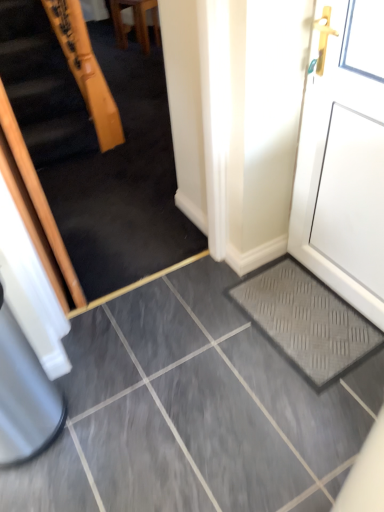
What is the approximate height of wooden chair at upper center?

The height of wooden chair at upper center is 19.81 inches.

This screenshot has height=512, width=384. What do you see at coordinates (307, 321) in the screenshot? I see `grey rubber doormat at lower right` at bounding box center [307, 321].

Describe the element at coordinates (93, 156) in the screenshot. The image size is (384, 512). I see `wooden handrail at upper left` at that location.

Identify the location of wooden chair at upper center. (135, 22).

Does white matte door at right have a smaller size compared to wooden chair at upper center?

Yes.

From the image's perspective, which is above, white matte door at right or wooden chair at upper center?

wooden chair at upper center.

Is white matte door at right oriented away from wooden chair at upper center?

No.

The image size is (384, 512). What are the coordinates of `door above the wooden chair at upper center (from a real-world perspective)` in the screenshot? It's located at (344, 157).

Who is more distant, grey rubber doormat at lower right or wooden chair at upper center?

wooden chair at upper center is behind.

Can you tell me how much grey rubber doormat at lower right and wooden chair at upper center differ in facing direction?

They differ by 17.9 degrees in their facing directions.

Which object is wider, grey rubber doormat at lower right or wooden chair at upper center?

grey rubber doormat at lower right is wider.

From the image's perspective, between grey rubber doormat at lower right and wooden chair at upper center, which one is located above?

wooden chair at upper center is shown above in the image.

Is wooden chair at upper center shorter than wooden handrail at upper left?

Yes.

From the image's perspective, is wooden chair at upper center beneath wooden handrail at upper left?

No, from the image's perspective, wooden chair at upper center is not beneath wooden handrail at upper left.

Looking at this image, can you confirm if wooden chair at upper center is bigger than wooden handrail at upper left?

No, wooden chair at upper center is not bigger than wooden handrail at upper left.

Is wooden chair at upper center not inside wooden handrail at upper left?

wooden chair at upper center lies outside wooden handrail at upper left's area.

Is wooden chair at upper center at the right side of white matte door at right?

No.

Is wooden chair at upper center positioned with its back to white matte door at right?

wooden chair at upper center is not turned away from white matte door at right.

Looking at this image, from the image's perspective, is wooden chair at upper center above white matte door at right?

Indeed, from the image's perspective, wooden chair at upper center is shown above white matte door at right.

Considering the positions of objects wooden handrail at upper left and white matte door at right in the image provided, who is more to the left, wooden handrail at upper left or white matte door at right?

Positioned to the left is wooden handrail at upper left.

Considering the positions of points (117, 90) and (318, 211), is point (117, 90) closer to camera compared to point (318, 211)?

No.

Does wooden handrail at upper left have a greater height compared to white matte door at right?

Indeed, wooden handrail at upper left has a greater height compared to white matte door at right.

Does wooden handrail at upper left touch white matte door at right?

wooden handrail at upper left and white matte door at right are clearly separated.

Considering the relative sizes of grey rubber doormat at lower right and wooden handrail at upper left in the image provided, is grey rubber doormat at lower right shorter than wooden handrail at upper left?

Indeed, grey rubber doormat at lower right has a lesser height compared to wooden handrail at upper left.

Are grey rubber doormat at lower right and wooden handrail at upper left far apart?

That's right, there is a large distance between grey rubber doormat at lower right and wooden handrail at upper left.

Between grey rubber doormat at lower right and wooden handrail at upper left, which one has smaller size?

Smaller between the two is grey rubber doormat at lower right.

Does grey rubber doormat at lower right come behind wooden handrail at upper left?

Yes, grey rubber doormat at lower right is further from the camera.

Is point (143, 37) less distant than point (261, 275)?

No.

From the image's perspective, which one is positioned lower, wooden chair at upper center or grey rubber doormat at lower right?

grey rubber doormat at lower right.

Looking at this image, considering the sizes of objects wooden chair at upper center and grey rubber doormat at lower right in the image provided, who is smaller, wooden chair at upper center or grey rubber doormat at lower right?

Smaller between the two is grey rubber doormat at lower right.

Does wooden chair at upper center contain grey rubber doormat at lower right?

Definitely not — grey rubber doormat at lower right is not inside wooden chair at upper center.

Find the location of a particular element. The height and width of the screenshot is (512, 384). furniture above the white matte door at right (from the image's perspective) is located at coordinates (135, 22).

Locate an element on the screen. The height and width of the screenshot is (512, 384). furniture behind the grey rubber doormat at lower right is located at coordinates (135, 22).

Considering their positions, is wooden chair at upper center positioned further to wooden handrail at upper left than white matte door at right?

Based on the image, wooden chair at upper center appears to be further to wooden handrail at upper left.

From the image, which object appears to be farther from white matte door at right, grey rubber doormat at lower right or wooden handrail at upper left?

wooden handrail at upper left is further to white matte door at right.

Considering their positions, is wooden handrail at upper left positioned closer to white matte door at right than grey rubber doormat at lower right?

The object closer to white matte door at right is grey rubber doormat at lower right.

Considering their positions, is grey rubber doormat at lower right positioned closer to white matte door at right than wooden chair at upper center?

Among the two, grey rubber doormat at lower right is located nearer to white matte door at right.

Looking at the image, which one is located further to wooden handrail at upper left, white matte door at right or grey rubber doormat at lower right?

Based on the image, white matte door at right appears to be further to wooden handrail at upper left.

Considering their positions, is wooden chair at upper center positioned further to white matte door at right than grey rubber doormat at lower right?

Based on the image, wooden chair at upper center appears to be further to white matte door at right.

Which object lies further to the anchor point wooden chair at upper center, white matte door at right or grey rubber doormat at lower right?

Based on the image, grey rubber doormat at lower right appears to be further to wooden chair at upper center.

Which object lies nearer to the anchor point wooden chair at upper center, wooden handrail at upper left or white matte door at right?

wooden handrail at upper left lies closer to wooden chair at upper center than the other object.

The width and height of the screenshot is (384, 512). I want to click on escalator between white matte door at right and wooden chair at upper center from front to back, so click(x=93, y=156).

At what (x,y) coordinates should I click in order to perform the action: click on doormat situated between wooden handrail at upper left and white matte door at right from left to right. Please return your answer as a coordinate pair (x, y). Looking at the image, I should click on click(307, 321).

At what (x,y) coordinates should I click in order to perform the action: click on doormat located between wooden handrail at upper left and wooden chair at upper center in the depth direction. Please return your answer as a coordinate pair (x, y). The width and height of the screenshot is (384, 512). Looking at the image, I should click on (307, 321).

At what (x,y) coordinates should I click in order to perform the action: click on doormat located between white matte door at right and wooden chair at upper center in the depth direction. Please return your answer as a coordinate pair (x, y). Image resolution: width=384 pixels, height=512 pixels. Looking at the image, I should click on point(307,321).